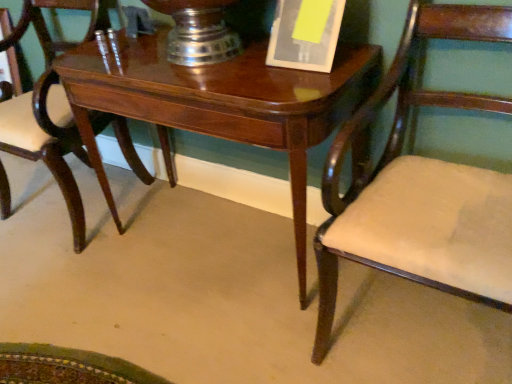
Question: Looking at their shapes, would you say glossy wood table at center is wider or thinner than matte wood chair at right, arranged as the 2th chair when viewed from the left?

Choices:
 (A) wide
 (B) thin

Answer: (B)

Question: Does point (314, 102) appear closer or farther from the camera than point (352, 249)?

Choices:
 (A) closer
 (B) farther

Answer: (B)

Question: Estimate the real-world distances between objects in this image. Which object is farther from the glossy wood table at center?

Choices:
 (A) mahogany wood chair at center, acting as the second chair starting from the right
 (B) matte wood chair at right, which appears as the first chair when viewed from the right
 (C) yellow paper at upper center

Answer: (A)

Question: Which object is the farthest from the glossy wood table at center?

Choices:
 (A) yellow paper at upper center
 (B) matte wood chair at right, which appears as the first chair when viewed from the right
 (C) mahogany wood chair at center, acting as the second chair starting from the right

Answer: (C)